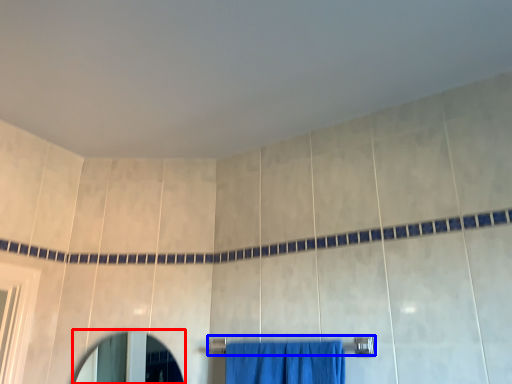
Question: Which object appears farthest to the camera in this image, mirror (highlighted by a red box) or towel bar (highlighted by a blue box)?

Choices:
 (A) mirror
 (B) towel bar

Answer: (A)